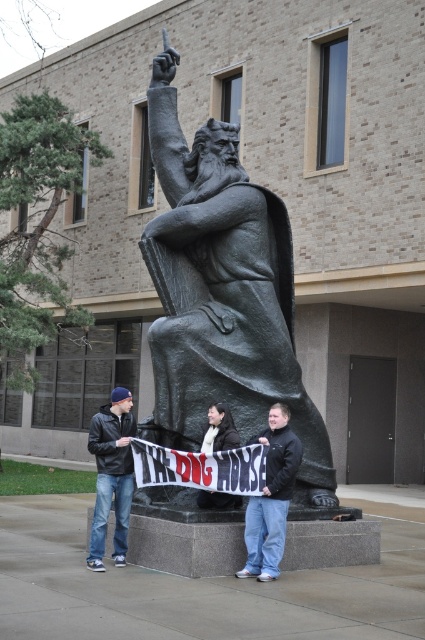
What are the coordinates of the matte black jacket at center?

The matte black jacket at center is located at coordinates point (272, 497).

You are a photographer trying to capture a photo of the statue and the people in front of it. You want to ensure that both the black leather jacket at lower left and the white scarf at center are clearly visible in the frame. Given their height difference, which one might you need to adjust your camera angle to focus on more carefully?

The black leather jacket at lower left is much taller than the white scarf at center, so you might need to adjust your camera angle to focus on the white scarf at center more carefully to ensure it is visible in the photo.

You are standing in front of the statue and want to locate the black leather jacket at lower left. What are the coordinates where you can find it?

The black leather jacket at lower left can be found at coordinates point (112, 474).